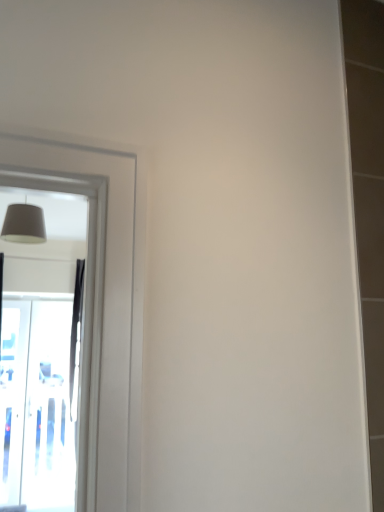
Question: Considering the positions of matte gray lampshade at upper left and transparent glass screen door at left in the image, is matte gray lampshade at upper left taller or shorter than transparent glass screen door at left?

Choices:
 (A) tall
 (B) short

Answer: (B)

Question: Considering the positions of point (26, 211) and point (3, 377), is point (26, 211) closer or farther from the camera than point (3, 377)?

Choices:
 (A) closer
 (B) farther

Answer: (A)

Question: From the image's perspective, is matte gray lampshade at upper left positioned above or below transparent glass screen door at left?

Choices:
 (A) above
 (B) below

Answer: (A)

Question: In terms of height, does transparent glass screen door at left look taller or shorter compared to matte gray lampshade at upper left?

Choices:
 (A) tall
 (B) short

Answer: (A)

Question: Based on their positions, is transparent glass screen door at left located to the left or right of matte gray lampshade at upper left?

Choices:
 (A) left
 (B) right

Answer: (A)

Question: From a real-world perspective, is transparent glass screen door at left above or below matte gray lampshade at upper left?

Choices:
 (A) above
 (B) below

Answer: (B)

Question: Considering the positions of point (13, 414) and point (21, 224), is point (13, 414) closer or farther from the camera than point (21, 224)?

Choices:
 (A) farther
 (B) closer

Answer: (A)